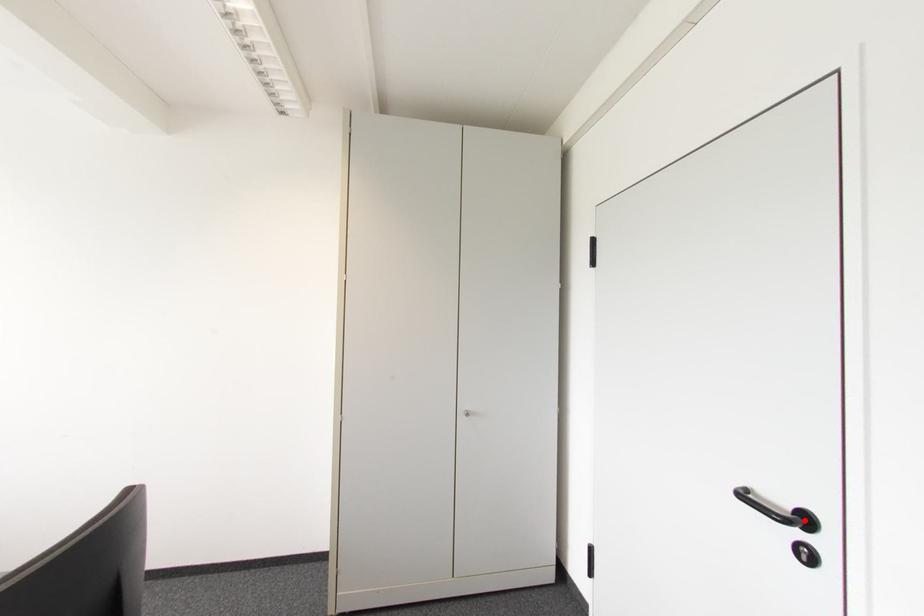
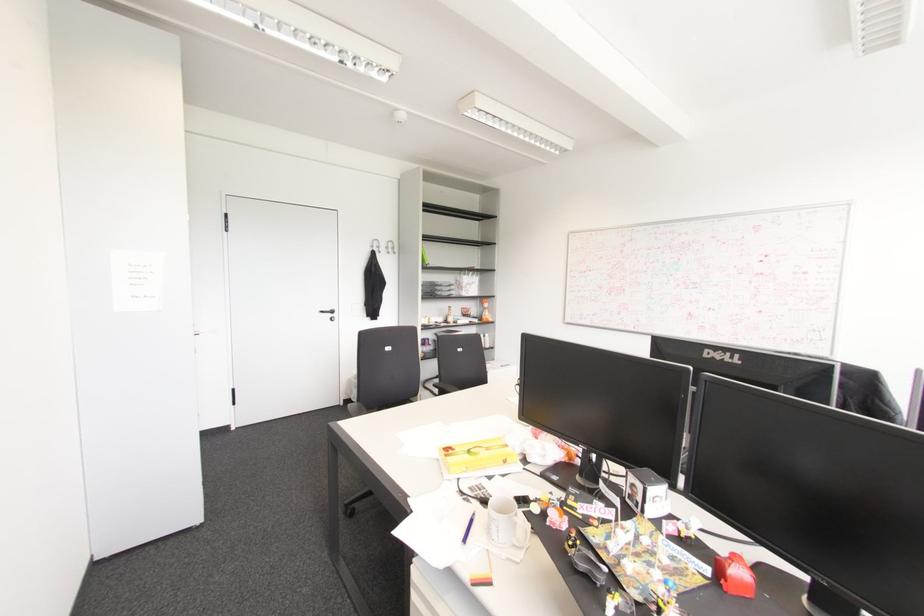
Where in the second image is the point corresponding to the highlighted location from the first image?

(332, 310)